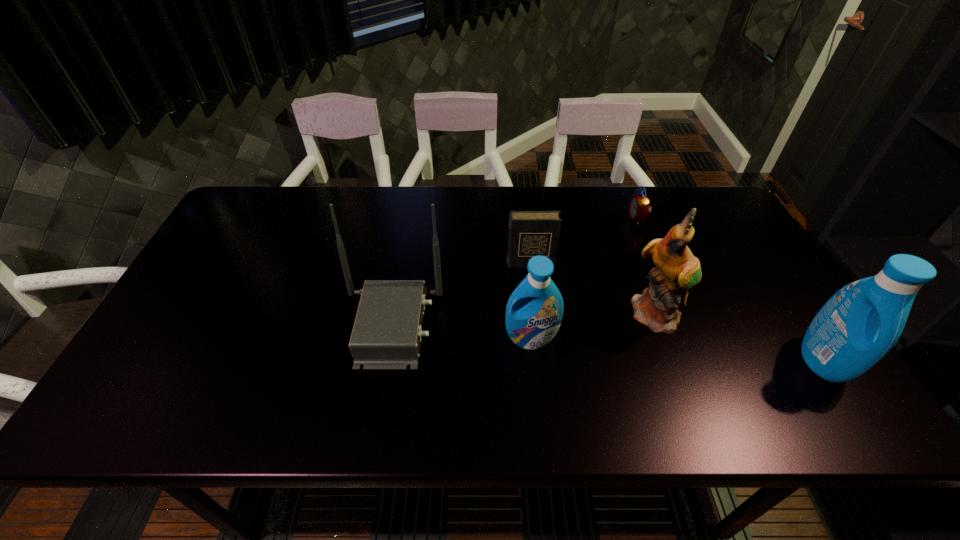
Given the evenly spaced detergents in the image, where should an extra detergent be added on the left to preserve the spacing? Please point to a vacant space. Please provide its 2D coordinates. Your answer should be formatted as a tuple, i.e. [(x, y)], where the tuple contains the x and y coordinates of a point satisfying the conditions above.

[(263, 317)]